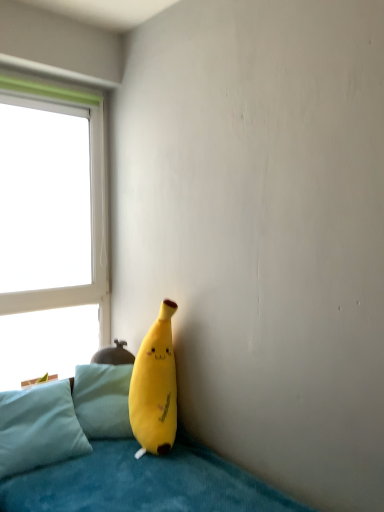
What is the approximate width of soft blue fabric couch at lower left?

5.56 feet.

This screenshot has width=384, height=512. Identify the location of white plastic window at upper left. (51, 229).

Identify the location of pillow in front of the yellow plush toy at lower center. This screenshot has width=384, height=512. (39, 428).

Is light blue plush pillow at lower left beside yellow plush toy at lower center?

No, light blue plush pillow at lower left is not beside yellow plush toy at lower center.

How many degrees apart are the facing directions of light blue plush pillow at lower left and yellow plush toy at lower center?

Result: 41.1 degrees separate the facing orientations of light blue plush pillow at lower left and yellow plush toy at lower center.

Which object is positioned more to the left, light blue plush pillow at lower left or yellow plush toy at lower center?

Positioned to the left is light blue plush pillow at lower left.

Does light blue plush pillow at lower left have a greater width compared to soft blue fabric couch at lower left?

No.

From the picture: Who is bigger, light blue plush pillow at lower left or soft blue fabric couch at lower left?

Bigger between the two is soft blue fabric couch at lower left.

Is light blue plush pillow at lower left spatially inside soft blue fabric couch at lower left, or outside of it?

light blue plush pillow at lower left exists entirely within soft blue fabric couch at lower left.

In the image, is light blue plush pillow at lower left positioned in front of or behind soft blue fabric couch at lower left?

In the image, light blue plush pillow at lower left appears behind soft blue fabric couch at lower left.

From a real-world perspective, does yellow plush toy at lower center stand above white plastic window at upper left?

No, from a real-world perspective, yellow plush toy at lower center is not on top of white plastic window at upper left.

Identify the location of banana lying in front of the white plastic window at upper left. (155, 387).

Could you tell me if yellow plush toy at lower center is turned towards white plastic window at upper left?

No, yellow plush toy at lower center is not aimed at white plastic window at upper left.

Which of these two, yellow plush toy at lower center or white plastic window at upper left, is smaller?

With smaller size is yellow plush toy at lower center.

Consider the image. What's the angular difference between white plastic window at upper left and yellow plush toy at lower center's facing directions?

The angular difference between white plastic window at upper left and yellow plush toy at lower center is 40.3 degrees.

Based on the photo, is white plastic window at upper left in front of or behind yellow plush toy at lower center in the image?

white plastic window at upper left is positioned farther from the viewer than yellow plush toy at lower center.

Between white plastic window at upper left and yellow plush toy at lower center, which one has larger width?

With larger width is yellow plush toy at lower center.

Is white plastic window at upper left taller than yellow plush toy at lower center?

Indeed, white plastic window at upper left has a greater height compared to yellow plush toy at lower center.

Considering the points (50, 510) and (149, 351), which point is in front, point (50, 510) or point (149, 351)?

Positioned in front is point (50, 510).

From a real-world perspective, between soft blue fabric couch at lower left and yellow plush toy at lower center, who is vertically higher?

In real-world perspective, yellow plush toy at lower center is above.

Is soft blue fabric couch at lower left wider than yellow plush toy at lower center?

Yes, soft blue fabric couch at lower left is wider than yellow plush toy at lower center.

Between white plastic window at upper left and light blue plush pillow at lower left, which one has less height?

With less height is light blue plush pillow at lower left.

Which object is wider, white plastic window at upper left or light blue plush pillow at lower left?

light blue plush pillow at lower left.

Would you say white plastic window at upper left is a long distance from light blue plush pillow at lower left?

No, white plastic window at upper left is not far away from light blue plush pillow at lower left.

In order to click on window that appears on the left of light blue plush pillow at lower left in this screenshot , I will do `click(51, 229)`.

Are soft blue fabric couch at lower left and light blue plush pillow at lower left located far from each other?

No, soft blue fabric couch at lower left is not far away from light blue plush pillow at lower left.

Does point (229, 502) appear closer or farther from the camera than point (53, 458)?

Clearly, point (229, 502) is closer to the camera than point (53, 458).

From a real-world perspective, between soft blue fabric couch at lower left and light blue plush pillow at lower left, who is vertically higher?

From a 3D spatial view, light blue plush pillow at lower left is above.

Which object is positioned more to the right, soft blue fabric couch at lower left or light blue plush pillow at lower left?

Positioned to the right is soft blue fabric couch at lower left.

You are a GUI agent. You are given a task and a screenshot of the screen. Output one action in this format:
    pyautogui.click(x=<x>, y=<y>)
    Task: Click on the pillow on the left of yellow plush toy at lower center
    The width and height of the screenshot is (384, 512).
    Given the screenshot: What is the action you would take?
    pyautogui.click(x=39, y=428)

You are a GUI agent. You are given a task and a screenshot of the screen. Output one action in this format:
    pyautogui.click(x=<x>, y=<y>)
    Task: Click on the pillow above the soft blue fabric couch at lower left (from the image's perspective)
    This screenshot has width=384, height=512.
    Given the screenshot: What is the action you would take?
    pyautogui.click(x=39, y=428)

Considering their positions, is yellow plush toy at lower center positioned closer to light blue plush pillow at lower left than soft blue fabric couch at lower left?

Based on the image, soft blue fabric couch at lower left appears to be nearer to light blue plush pillow at lower left.

Which object lies nearer to the anchor point yellow plush toy at lower center, white plastic window at upper left or light blue plush pillow at lower left?

light blue plush pillow at lower left is positioned closer to the anchor yellow plush toy at lower center.

Based on the photo, based on their spatial positions, is light blue plush pillow at lower left or white plastic window at upper left further from yellow plush toy at lower center?

The object further to yellow plush toy at lower center is white plastic window at upper left.

Looking at the image, which one is located closer to light blue plush pillow at lower left, white plastic window at upper left or yellow plush toy at lower center?

The object closer to light blue plush pillow at lower left is yellow plush toy at lower center.

From the image, which object appears to be farther from soft blue fabric couch at lower left, light blue plush pillow at lower left or yellow plush toy at lower center?

yellow plush toy at lower center is positioned further to the anchor soft blue fabric couch at lower left.

Estimate the real-world distances between objects in this image. Which object is further from light blue plush pillow at lower left, soft blue fabric couch at lower left or white plastic window at upper left?

Among the two, white plastic window at upper left is located further to light blue plush pillow at lower left.

Which object lies further to the anchor point white plastic window at upper left, light blue plush pillow at lower left or yellow plush toy at lower center?

yellow plush toy at lower center is positioned further to the anchor white plastic window at upper left.

When comparing their distances from white plastic window at upper left, does yellow plush toy at lower center or soft blue fabric couch at lower left seem further?

Among the two, soft blue fabric couch at lower left is located further to white plastic window at upper left.

Image resolution: width=384 pixels, height=512 pixels. Identify the location of pillow positioned between soft blue fabric couch at lower left and white plastic window at upper left from near to far. (39, 428).

At what (x,y) coordinates should I click in order to perform the action: click on banana positioned between soft blue fabric couch at lower left and white plastic window at upper left from near to far. Please return your answer as a coordinate pair (x, y). The image size is (384, 512). Looking at the image, I should click on (155, 387).

Where is `banana between white plastic window at upper left and light blue plush pillow at lower left vertically`? The width and height of the screenshot is (384, 512). banana between white plastic window at upper left and light blue plush pillow at lower left vertically is located at coordinates (155, 387).

Where is `pillow positioned between soft blue fabric couch at lower left and yellow plush toy at lower center from near to far`? This screenshot has height=512, width=384. pillow positioned between soft blue fabric couch at lower left and yellow plush toy at lower center from near to far is located at coordinates (39, 428).